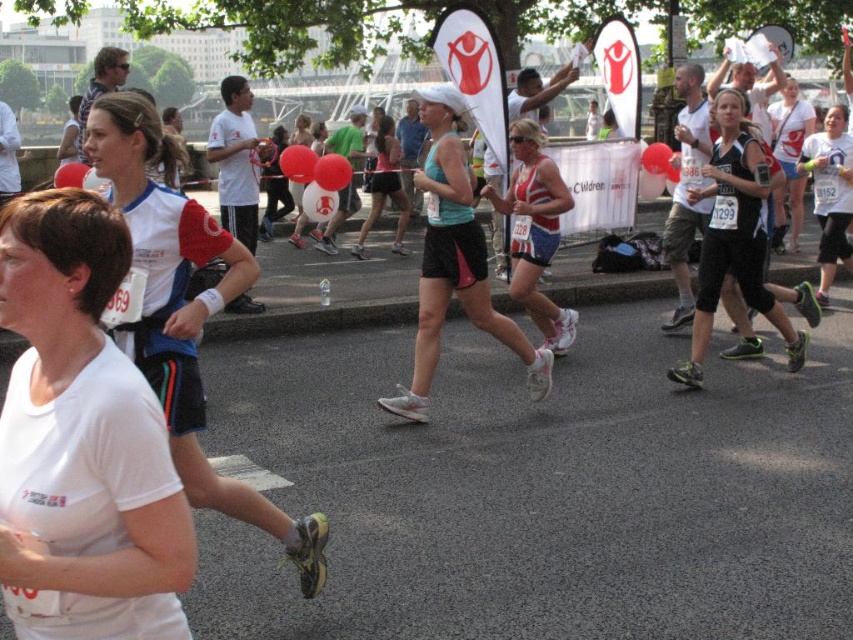
Question: Which point is closer to the camera?

Choices:
 (A) pos(73,426)
 (B) pos(553,353)

Answer: (A)

Question: Which object is the farthest from the matte teal tank top at center?

Choices:
 (A) black mesh tank top at center
 (B) matte white tank top at center

Answer: (A)

Question: Does white matte t-shirt at center have a larger size compared to matte blue tank top at center?

Choices:
 (A) yes
 (B) no

Answer: (B)

Question: Estimate the real-world distances between objects in this image. Which object is farther from the matte white tank top at center?

Choices:
 (A) white matte t-shirt at center
 (B) matte teal tank top at center
 (C) black mesh tank top at center

Answer: (A)

Question: Is white matte t-shirt at center smaller than white matte running shoe at left?

Choices:
 (A) yes
 (B) no

Answer: (A)

Question: Does matte teal tank top at center have a lesser width compared to black mesh tank top at center?

Choices:
 (A) no
 (B) yes

Answer: (B)